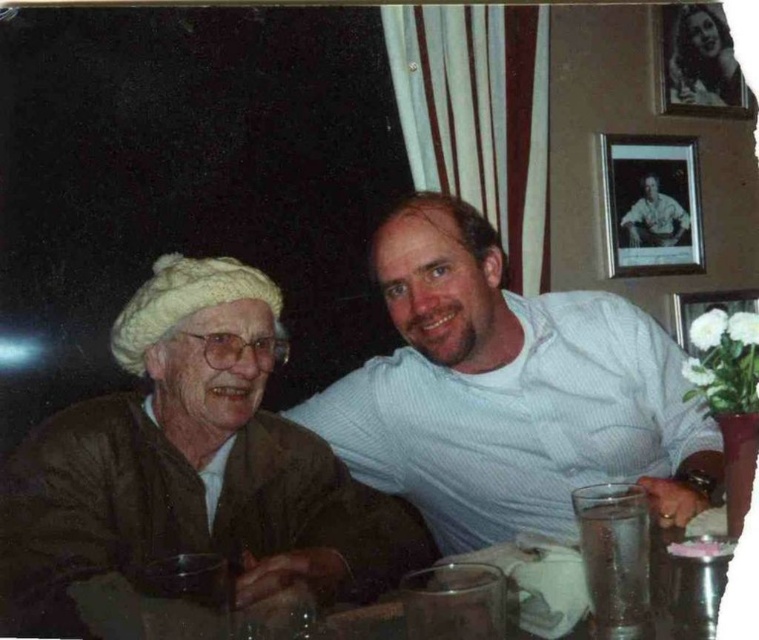
Does matte white shirt at upper right appear on the left side of white matte picture frame at upper right?

Indeed, matte white shirt at upper right is positioned on the left side of white matte picture frame at upper right.

Looking at this image, does matte white shirt at upper right have a larger size compared to white matte picture frame at upper right?

Incorrect, matte white shirt at upper right is not larger than white matte picture frame at upper right.

Between point (666, 236) and point (723, 292), which one is positioned behind?

Positioned behind is point (723, 292).

The image size is (759, 640). Identify the location of matte white shirt at upper right. (654, 218).

Is white textured shirt at center below smooth glossy portrait at upper right?

Correct, white textured shirt at center is located below smooth glossy portrait at upper right.

Which is more to the right, white textured shirt at center or smooth glossy portrait at upper right?

Positioned to the right is smooth glossy portrait at upper right.

Is point (518, 401) in front of point (691, 12)?

Yes.

Where is `white textured shirt at center`? The width and height of the screenshot is (759, 640). white textured shirt at center is located at coordinates (506, 392).

Can you confirm if smooth glossy portrait at upper right is positioned above white matte picture frame at upper right?

Yes.

Where is `smooth glossy portrait at upper right`? The image size is (759, 640). smooth glossy portrait at upper right is located at coordinates (698, 61).